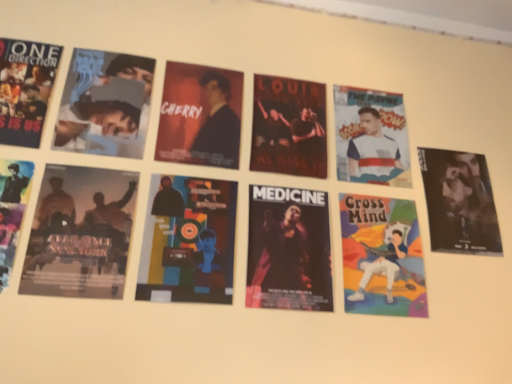
Describe the element at coordinates (12, 210) in the screenshot. This screenshot has width=512, height=384. I see `matte black poster at left, which is the 6th poster in right-to-left order` at that location.

Measure the distance between point (1, 273) and camera.

The distance of point (1, 273) from camera is 34.72 inches.

Identify the location of multicolored paper at center, positioned as the third poster in left-to-right order. This screenshot has width=512, height=384. (188, 241).

Image resolution: width=512 pixels, height=384 pixels. What are the coordinates of `dark matte poster at center, positioned as the fourth poster in left-to-right order` in the screenshot? It's located at (288, 249).

The height and width of the screenshot is (384, 512). What do you see at coordinates (288, 249) in the screenshot?
I see `dark matte poster at center, arranged as the third poster when viewed from the right` at bounding box center [288, 249].

Where is `matte black poster at left, which is the first poster in left-to-right order`? matte black poster at left, which is the first poster in left-to-right order is located at coordinates (12, 210).

What's the angular difference between multicolored paper cross my mind poster at center right, the sixth poster positioned from the left, and matte black poster at left, which is the first poster in left-to-right order,'s facing directions?

They differ by 1.49 degrees in their facing directions.

Which of these two, multicolored paper cross my mind poster at center right, the sixth poster positioned from the left, or matte black poster at left, which is the 6th poster in right-to-left order, is wider?

With larger width is matte black poster at left, which is the 6th poster in right-to-left order.

Considering their positions, is multicolored paper cross my mind poster at center right, the sixth poster positioned from the left, located in front of or behind matte black poster at left, which is the first poster in left-to-right order?

In the image, multicolored paper cross my mind poster at center right, the sixth poster positioned from the left, appears behind matte black poster at left, which is the first poster in left-to-right order.

Is silhouette paper poster at lower left, positioned as the 5th poster in right-to-left order, at the back of dark matte poster at center, the 2th poster positioned from the right?

No, dark matte poster at center, the 2th poster positioned from the right,'s orientation is not away from silhouette paper poster at lower left, positioned as the 5th poster in right-to-left order.

Considering the relative sizes of dark matte poster at center, the 2th poster positioned from the right, and silhouette paper poster at lower left, positioned as the 5th poster in right-to-left order, in the image provided, is dark matte poster at center, the 2th poster positioned from the right, taller than silhouette paper poster at lower left, positioned as the 5th poster in right-to-left order,?

Yes.

From the picture: Which is behind, dark matte poster at center, the 2th poster positioned from the right, or silhouette paper poster at lower left, positioned as the 5th poster in right-to-left order?

dark matte poster at center, the 2th poster positioned from the right, is further away from the camera.

From the image's perspective, relative to silhouette paper poster at lower left, positioned as the 5th poster in right-to-left order, is dark matte poster at center, the 5th poster in the left-to-right sequence, above or below?

From the image's perspective, dark matte poster at center, the 5th poster in the left-to-right sequence, appears above silhouette paper poster at lower left, positioned as the 5th poster in right-to-left order.

Which object is closer to the camera, multicolored paper cross my mind poster at center right, which is counted as the first poster, starting from the right, or matte black jacket at center, acting as the 3th person starting from the right?

multicolored paper cross my mind poster at center right, which is counted as the first poster, starting from the right.

How different are the orientations of multicolored paper cross my mind poster at center right, which is counted as the first poster, starting from the right, and matte black jacket at center, acting as the 3th person starting from the right, in degrees?

The angular difference between multicolored paper cross my mind poster at center right, which is counted as the first poster, starting from the right, and matte black jacket at center, acting as the 3th person starting from the right, is 1.49 degrees.

From the image's perspective, is multicolored paper cross my mind poster at center right, which is counted as the first poster, starting from the right, on matte black jacket at center, acting as the 3th person starting from the right?

No, from the image's perspective, multicolored paper cross my mind poster at center right, which is counted as the first poster, starting from the right, is not over matte black jacket at center, acting as the 3th person starting from the right.

Consider the image. Between multicolored paper cross my mind poster at center right, the sixth poster positioned from the left, and matte black jacket at center, the second person in the left-to-right sequence, which one has more height?

Standing taller between the two is multicolored paper cross my mind poster at center right, the sixth poster positioned from the left.

How many degrees apart are the facing directions of matte black poster at upper left, placed as the fourth person when sorted from right to left, and white fabric shirt at upper right, acting as the second person starting from the right?

They differ by 1.49 degrees in their facing directions.

Looking at their sizes, would you say matte black poster at upper left, the first person in the left-to-right sequence, is wider or thinner than white fabric shirt at upper right, marked as the 3th person in a left-to-right arrangement?

In the image, matte black poster at upper left, the first person in the left-to-right sequence, appears to be wider than white fabric shirt at upper right, marked as the 3th person in a left-to-right arrangement.

Is point (139, 140) closer to camera compared to point (377, 170)?

Yes.

From the image's perspective, relative to white fabric shirt at upper right, acting as the second person starting from the right, is matte black poster at upper left, placed as the fourth person when sorted from right to left, above or below?

From the image's perspective, matte black poster at upper left, placed as the fourth person when sorted from right to left, appears above white fabric shirt at upper right, acting as the second person starting from the right.

Which point is more distant from viewer, [7,183] or [436,190]?

The point [436,190] is farther.

Between matte black poster at left, which is the 6th poster in right-to-left order, and shiny black jacket at right, the first person when ordered from right to left, which one has smaller width?

With smaller width is shiny black jacket at right, the first person when ordered from right to left.

From a real-world perspective, which is physically above, matte black poster at left, which is the first poster in left-to-right order, or shiny black jacket at right, the first person when ordered from right to left?

From a 3D spatial view, shiny black jacket at right, the first person when ordered from right to left, is above.

Is matte black poster at left, which is the first poster in left-to-right order, facing towards shiny black jacket at right, the first person when ordered from right to left?

No, matte black poster at left, which is the first poster in left-to-right order, is not facing towards shiny black jacket at right, the first person when ordered from right to left.

From a real-world perspective, which is physically above, multicolored paper cross my mind poster at center right, which is counted as the first poster, starting from the right, or multicolored paper at center, positioned as the third poster in left-to-right order?

In real-world perspective, multicolored paper at center, positioned as the third poster in left-to-right order, is above.

Considering the sizes of multicolored paper cross my mind poster at center right, the sixth poster positioned from the left, and multicolored paper at center, positioned as the third poster in left-to-right order, in the image, is multicolored paper cross my mind poster at center right, the sixth poster positioned from the left, bigger or smaller than multicolored paper at center, positioned as the third poster in left-to-right order,?

Considering their sizes, multicolored paper cross my mind poster at center right, the sixth poster positioned from the left, takes up less space than multicolored paper at center, positioned as the third poster in left-to-right order.

Could you measure the distance between multicolored paper cross my mind poster at center right, which is counted as the first poster, starting from the right, and multicolored paper at center, positioned as the third poster in left-to-right order?

The distance of multicolored paper cross my mind poster at center right, which is counted as the first poster, starting from the right, from multicolored paper at center, positioned as the third poster in left-to-right order, is 14.58 inches.

Does multicolored paper cross my mind poster at center right, the sixth poster positioned from the left, lie behind multicolored paper at center, positioned as the third poster in left-to-right order?

Yes.

Considering the sizes of objects matte black poster at left, which is the first poster in left-to-right order, and matte black jacket at center, the second person in the left-to-right sequence, in the image provided, who is taller, matte black poster at left, which is the first poster in left-to-right order, or matte black jacket at center, the second person in the left-to-right sequence,?

matte black jacket at center, the second person in the left-to-right sequence, is taller.

Are matte black poster at left, which is the first poster in left-to-right order, and matte black jacket at center, the second person in the left-to-right sequence, making contact?

They are not placed beside each other.

Between matte black poster at left, which is the 6th poster in right-to-left order, and matte black jacket at center, acting as the 3th person starting from the right, which one has smaller width?

matte black jacket at center, acting as the 3th person starting from the right, is thinner.

From a real-world perspective, is matte black poster at left, which is the first poster in left-to-right order, on matte black jacket at center, acting as the 3th person starting from the right?

Incorrect, from a real-world perspective, matte black poster at left, which is the first poster in left-to-right order, is lower than matte black jacket at center, acting as the 3th person starting from the right.

This screenshot has width=512, height=384. Find the location of `poster that is the 4th object located in front of the multicolored paper cross my mind poster at center right, the sixth poster positioned from the left`. poster that is the 4th object located in front of the multicolored paper cross my mind poster at center right, the sixth poster positioned from the left is located at coordinates (12, 210).

From the dark matte poster at center, the 5th poster in the left-to-right sequence, count the 3rd poster to the left and point to it. Please provide its 2D coordinates.

[(80, 233)]

Considering their positions, is multicolored paper at center, positioned as the third poster in left-to-right order, positioned further to shiny black jacket at right, the first person when ordered from right to left, than multicolored paper cross my mind poster at center right, which is counted as the first poster, starting from the right?

multicolored paper at center, positioned as the third poster in left-to-right order, is positioned further to the anchor shiny black jacket at right, the first person when ordered from right to left.

In the scene shown: From the image, which object appears to be nearer to dark matte poster at center, positioned as the fourth poster in left-to-right order, matte black poster at left, which is the 6th poster in right-to-left order, or multicolored paper cross my mind poster at center right, the sixth poster positioned from the left?

multicolored paper cross my mind poster at center right, the sixth poster positioned from the left.

Considering their positions, is white fabric shirt at upper right, acting as the second person starting from the right, positioned closer to multicolored paper cross my mind poster at center right, the sixth poster positioned from the left, than matte black poster at upper left, the first person in the left-to-right sequence?

white fabric shirt at upper right, acting as the second person starting from the right, is closer to multicolored paper cross my mind poster at center right, the sixth poster positioned from the left.

Considering their positions, is dark matte poster at center, the 5th poster in the left-to-right sequence, positioned closer to white fabric shirt at upper right, marked as the 3th person in a left-to-right arrangement, than matte black jacket at center, acting as the 3th person starting from the right?

Among the two, dark matte poster at center, the 5th poster in the left-to-right sequence, is located nearer to white fabric shirt at upper right, marked as the 3th person in a left-to-right arrangement.

Considering their positions, is white fabric shirt at upper right, acting as the second person starting from the right, positioned closer to matte black poster at left, which is the 6th poster in right-to-left order, than dark matte poster at center, the 2th poster positioned from the right?

The object closer to matte black poster at left, which is the 6th poster in right-to-left order, is dark matte poster at center, the 2th poster positioned from the right.

Estimate the real-world distances between objects in this image. Which object is further from multicolored paper at center, the fourth poster when ordered from right to left, multicolored paper cross my mind poster at center right, which is counted as the first poster, starting from the right, or matte black jacket at center, acting as the 3th person starting from the right?

Based on the image, multicolored paper cross my mind poster at center right, which is counted as the first poster, starting from the right, appears to be further to multicolored paper at center, the fourth poster when ordered from right to left.

Based on their spatial positions, is matte black jacket at center, acting as the 3th person starting from the right, or white fabric shirt at upper right, marked as the 3th person in a left-to-right arrangement, further from shiny black jacket at right, the first person when ordered from right to left?

matte black jacket at center, acting as the 3th person starting from the right, lies further to shiny black jacket at right, the first person when ordered from right to left, than the other object.

From the image, which object appears to be nearer to matte black poster at left, which is the first poster in left-to-right order, shiny black jacket at right, the first person when ordered from right to left, or white fabric shirt at upper right, marked as the 3th person in a left-to-right arrangement?

white fabric shirt at upper right, marked as the 3th person in a left-to-right arrangement, is positioned closer to the anchor matte black poster at left, which is the first poster in left-to-right order.

Image resolution: width=512 pixels, height=384 pixels. In order to click on person located between matte black poster at upper left, placed as the fourth person when sorted from right to left, and white fabric shirt at upper right, acting as the second person starting from the right, in the left-right direction in this screenshot , I will do `click(217, 125)`.

Where is `person located between dark matte poster at center, the 5th poster in the left-to-right sequence, and shiny black jacket at right, which is the fourth person in left-to-right order, in the left-right direction`? Image resolution: width=512 pixels, height=384 pixels. person located between dark matte poster at center, the 5th poster in the left-to-right sequence, and shiny black jacket at right, which is the fourth person in left-to-right order, in the left-right direction is located at coordinates (374, 147).

Locate an element on the screen. The image size is (512, 384). person between matte black poster at upper left, the first person in the left-to-right sequence, and dark matte poster at center, positioned as the fourth poster in left-to-right order is located at coordinates (217, 125).

The image size is (512, 384). Find the location of `poster between matte black poster at left, which is the 6th poster in right-to-left order, and multicolored paper at center, the fourth poster when ordered from right to left, in the horizontal direction`. poster between matte black poster at left, which is the 6th poster in right-to-left order, and multicolored paper at center, the fourth poster when ordered from right to left, in the horizontal direction is located at coordinates (80, 233).